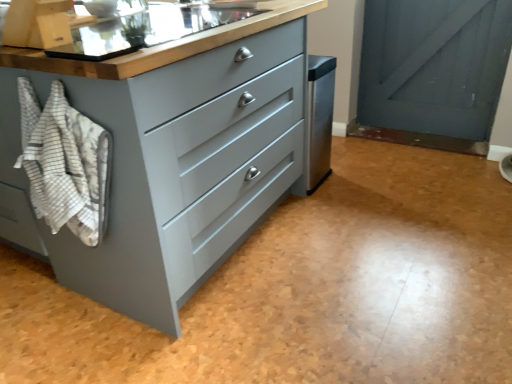
This screenshot has height=384, width=512. Identify the location of vacant area that is situated to the right of matte gray chest of drawers at center. (388, 234).